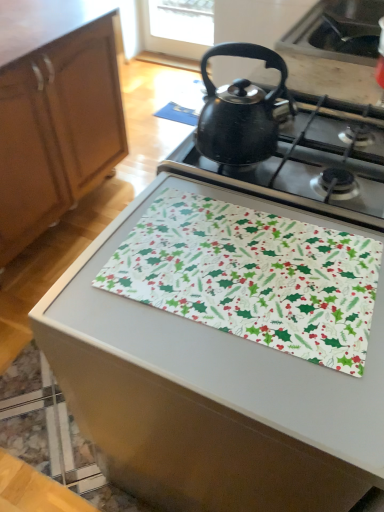
Question: Is white fabric with holiday pattern at center bigger than black matte kettle at upper center?

Choices:
 (A) yes
 (B) no

Answer: (B)

Question: Is black matte kettle at upper center a part of white fabric with holiday pattern at center?

Choices:
 (A) yes
 (B) no

Answer: (B)

Question: From a real-world perspective, is white fabric with holiday pattern at center on black matte kettle at upper center?

Choices:
 (A) yes
 (B) no

Answer: (A)

Question: Is white fabric with holiday pattern at center further to the viewer compared to black matte kettle at upper center?

Choices:
 (A) yes
 (B) no

Answer: (B)

Question: Can you see white fabric with holiday pattern at center touching black matte kettle at upper center?

Choices:
 (A) yes
 (B) no

Answer: (B)

Question: Relative to black matte sink at upper right, is wooden cabinet at left in front or behind?

Choices:
 (A) behind
 (B) front

Answer: (B)

Question: Choose the correct answer: Is wooden cabinet at left inside black matte sink at upper right or outside it?

Choices:
 (A) inside
 (B) outside

Answer: (B)

Question: Is wooden cabinet at left bigger or smaller than black matte sink at upper right?

Choices:
 (A) big
 (B) small

Answer: (A)

Question: In terms of width, does wooden cabinet at left look wider or thinner when compared to black matte sink at upper right?

Choices:
 (A) wide
 (B) thin

Answer: (A)

Question: Visually, is white fabric placemat at center positioned to the left or to the right of black matte kettle at upper center?

Choices:
 (A) right
 (B) left

Answer: (B)

Question: From the image's perspective, is white fabric placemat at center positioned above or below black matte kettle at upper center?

Choices:
 (A) above
 (B) below

Answer: (B)

Question: Is white fabric placemat at center in front of or behind black matte kettle at upper center in the image?

Choices:
 (A) front
 (B) behind

Answer: (A)

Question: Would you say white fabric placemat at center is inside or outside black matte kettle at upper center?

Choices:
 (A) inside
 (B) outside

Answer: (B)

Question: Considering the positions of point (296, 155) and point (354, 3), is point (296, 155) closer or farther from the camera than point (354, 3)?

Choices:
 (A) farther
 (B) closer

Answer: (B)

Question: Looking at the image, does black matte kettle at upper center seem bigger or smaller compared to black matte sink at upper right?

Choices:
 (A) big
 (B) small

Answer: (A)